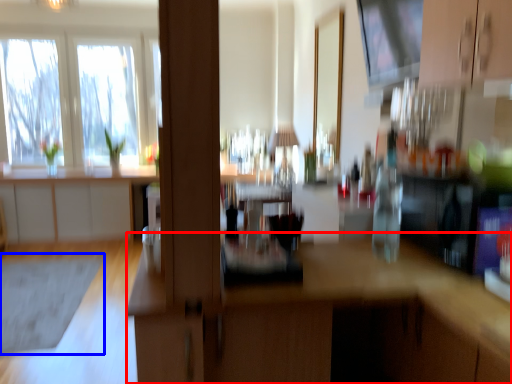
Question: Which object appears farthest to the camera in this image, computer desk (highlighted by a red box) or mat (highlighted by a blue box)?

Choices:
 (A) computer desk
 (B) mat

Answer: (B)